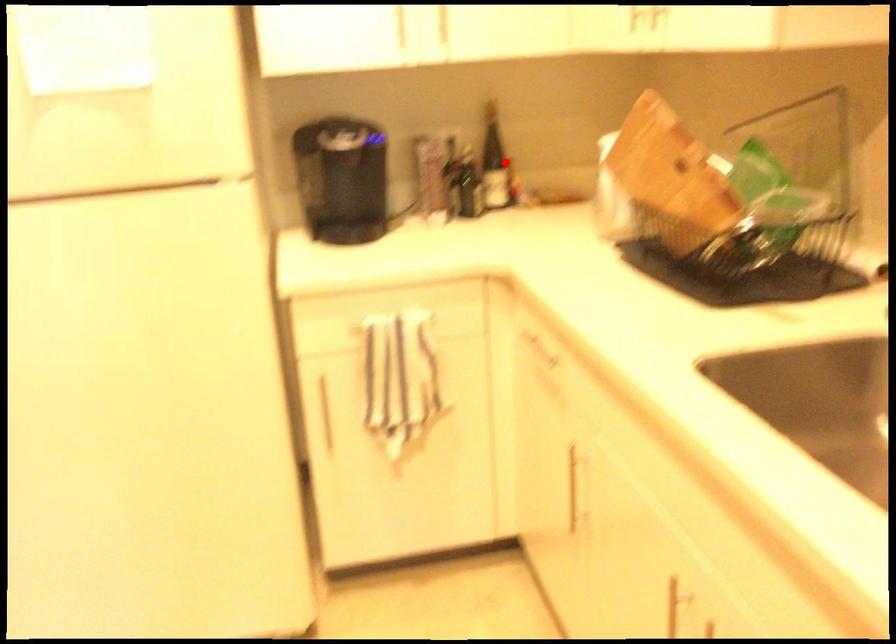
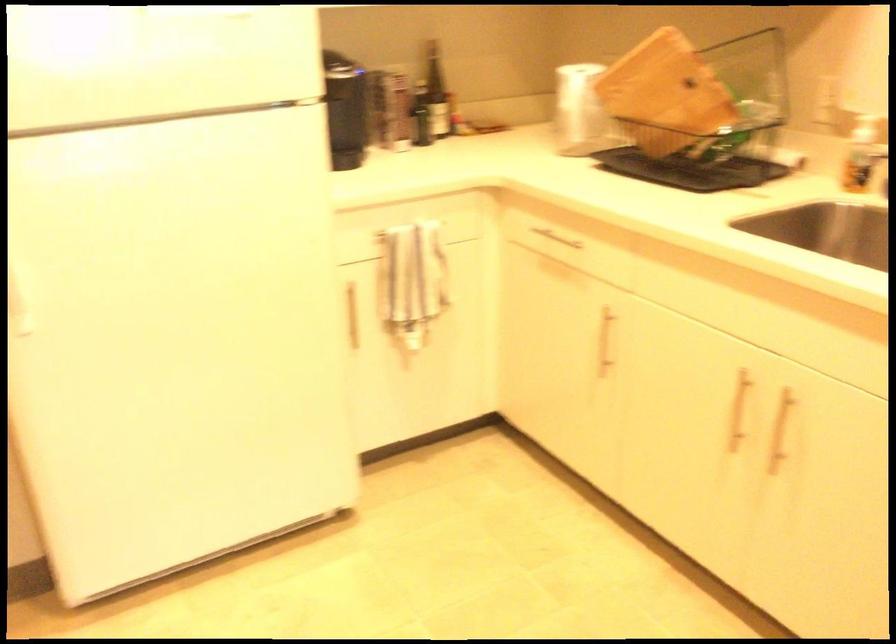
Question: I am providing you with two images of the same scene from different viewpoints. A red point is shown in image1. For the corresponding object point in image2, is it positioned nearer or farther from the camera?

Choices:
 (A) Nearer
 (B) Farther

Answer: (B)